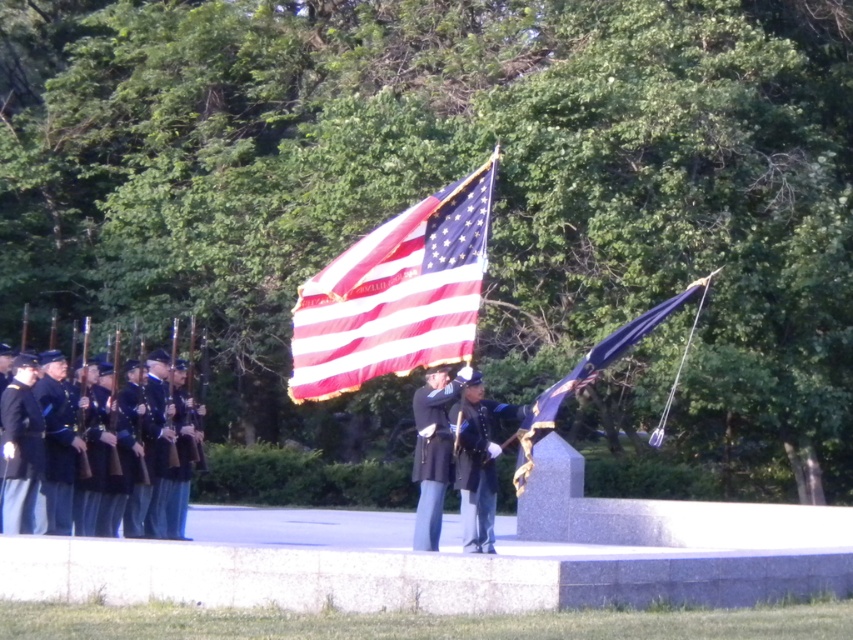
Question: Does blue uniformed soldiers at left have a larger size compared to blue satin flag at center?

Choices:
 (A) no
 (B) yes

Answer: (B)

Question: Does shiny blue fabric uniform at center appear on the left side of blue satin flag at center?

Choices:
 (A) no
 (B) yes

Answer: (B)

Question: Is dark blue wool jacket at center below blue satin flag at center?

Choices:
 (A) yes
 (B) no

Answer: (A)

Question: Which point is farther from the camera taking this photo?

Choices:
 (A) (306, 349)
 (B) (480, 481)
 (C) (444, 413)
 (D) (9, 474)

Answer: (B)

Question: Estimate the real-world distances between objects in this image. Which object is closer to the blue satin flag at center?

Choices:
 (A) matte fabric flag at center
 (B) shiny blue fabric uniform at center
 (C) dark blue wool jacket at center

Answer: (B)

Question: Which of the following is the farthest from the observer?

Choices:
 (A) dark blue wool jacket at center
 (B) blue uniformed soldiers at left
 (C) matte fabric flag at center

Answer: (A)